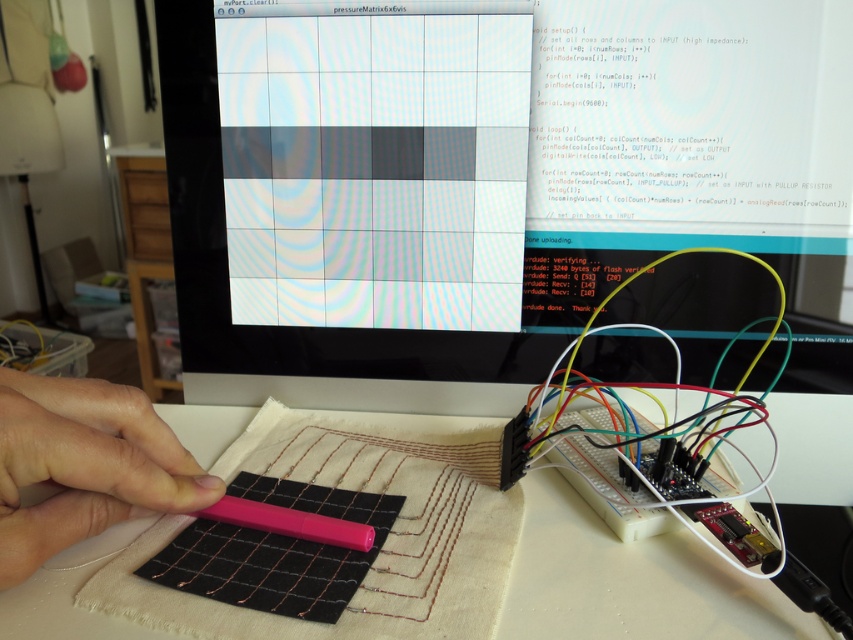
Is matte black screen at center positioned at the back of pink matte pen at lower left?

Yes.

Is point (434, 173) positioned in front of point (33, 449)?

No, it is not.

Locate an element on the screen. matte black screen at center is located at coordinates (494, 188).

Is point (552, 548) farther from camera compared to point (80, 404)?

Yes, it is behind point (80, 404).

What do you see at coordinates (630, 580) in the screenshot? I see `white fabric at center` at bounding box center [630, 580].

You are a GUI agent. You are given a task and a screenshot of the screen. Output one action in this format:
    pyautogui.click(x=<x>, y=<y>)
    Task: Click on the white fabric at center
    The image size is (853, 640).
    Given the screenshot: What is the action you would take?
    pyautogui.click(x=630, y=580)

Which is above, matte black screen at center or white fabric at center?

Positioned higher is matte black screen at center.

Image resolution: width=853 pixels, height=640 pixels. What do you see at coordinates (494, 188) in the screenshot?
I see `matte black screen at center` at bounding box center [494, 188].

Locate an element on the screen. matte black screen at center is located at coordinates (494, 188).